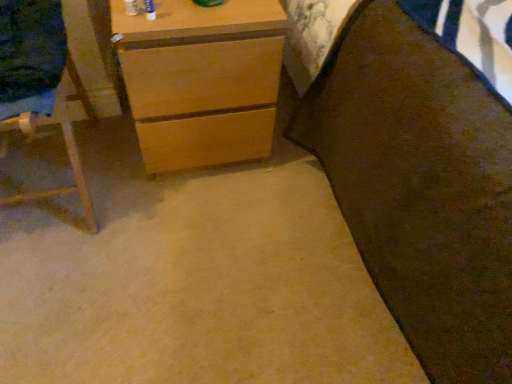
Find the location of a particular element. This screenshot has height=384, width=512. empty space that is to the right of wooden easel at left is located at coordinates (143, 210).